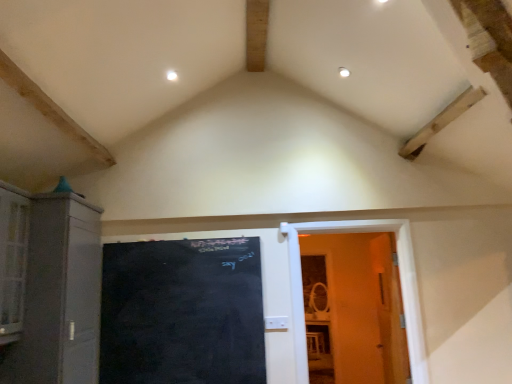
Question: Can you confirm if wooden door at right is taller than black chalkboard at center?

Choices:
 (A) no
 (B) yes

Answer: (B)

Question: From a real-world perspective, is wooden door at right positioned over black chalkboard at center based on gravity?

Choices:
 (A) no
 (B) yes

Answer: (B)

Question: Does wooden door at right have a smaller size compared to black chalkboard at center?

Choices:
 (A) no
 (B) yes

Answer: (A)

Question: Is wooden door at right to the left of black chalkboard at center from the viewer's perspective?

Choices:
 (A) yes
 (B) no

Answer: (B)

Question: Considering the relative sizes of wooden door at right and black chalkboard at center in the image provided, is wooden door at right wider than black chalkboard at center?

Choices:
 (A) yes
 (B) no

Answer: (A)

Question: Is wooden door at right in front of or behind black chalkboard at center in the image?

Choices:
 (A) behind
 (B) front

Answer: (A)

Question: Is wooden door at right taller or shorter than black chalkboard at center?

Choices:
 (A) short
 (B) tall

Answer: (B)

Question: From the image's perspective, relative to black chalkboard at center, is wooden door at right above or below?

Choices:
 (A) below
 (B) above

Answer: (B)

Question: Considering the positions of wooden door at right and black chalkboard at center in the image, is wooden door at right wider or thinner than black chalkboard at center?

Choices:
 (A) thin
 (B) wide

Answer: (B)

Question: Considering their positions, is black chalkboard at center located in front of or behind wooden door at right?

Choices:
 (A) front
 (B) behind

Answer: (A)

Question: Is point (131, 332) closer or farther from the camera than point (399, 241)?

Choices:
 (A) farther
 (B) closer

Answer: (B)

Question: Considering the relative positions of black chalkboard at center and wooden door at right in the image provided, is black chalkboard at center to the left or to the right of wooden door at right?

Choices:
 (A) left
 (B) right

Answer: (A)

Question: Based on their sizes in the image, would you say black chalkboard at center is bigger or smaller than wooden door at right?

Choices:
 (A) small
 (B) big

Answer: (A)

Question: Is point (46, 213) closer or farther from the camera than point (295, 327)?

Choices:
 (A) farther
 (B) closer

Answer: (B)

Question: From a real-world perspective, is matte gray cabinet at left above or below wooden door at right?

Choices:
 (A) above
 (B) below

Answer: (A)